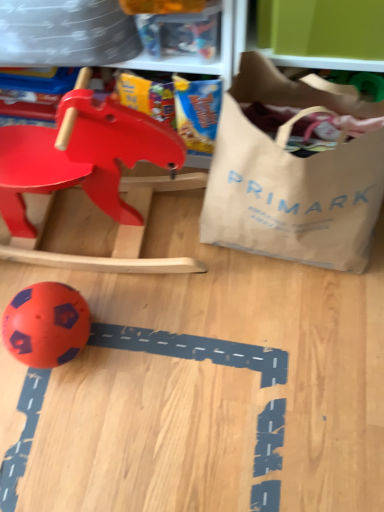
Identify the location of vacant space behind orange rubber ball at lower left, positioned as the first toy in bottom-to-top order. This screenshot has width=384, height=512. (63, 261).